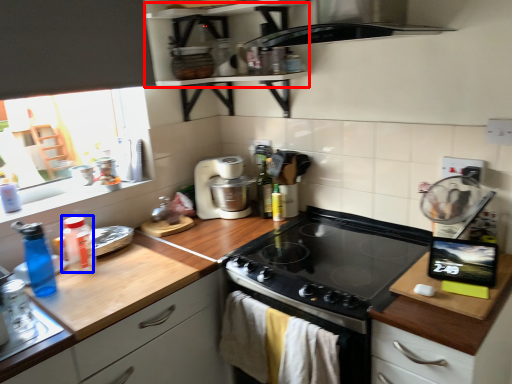
Question: Which of the following is the farthest to the observer, shelf (highlighted by a red box) or bottle (highlighted by a blue box)?

Choices:
 (A) shelf
 (B) bottle

Answer: (B)